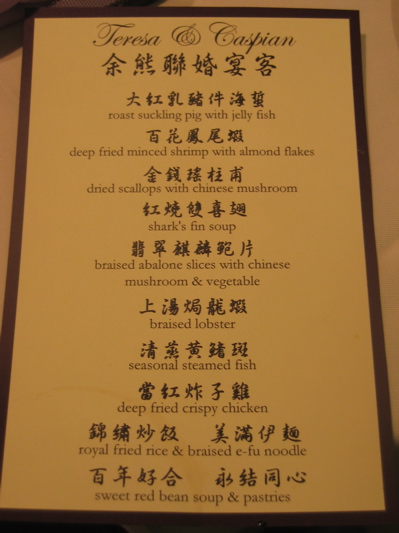
Identify the location of white table. Image resolution: width=399 pixels, height=533 pixels. (388, 99).